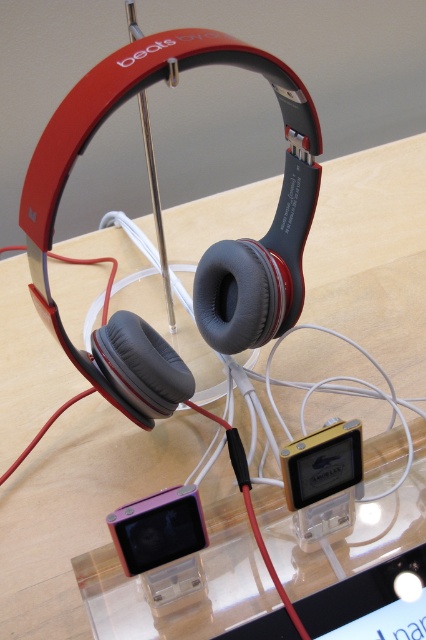
Does pink glossy ipod at lower center have a smaller size compared to metallic pink ipod at center?

Actually, pink glossy ipod at lower center might be larger than metallic pink ipod at center.

Is pink glossy ipod at lower center closer to camera compared to metallic pink ipod at center?

Yes, pink glossy ipod at lower center is closer to the viewer.

This screenshot has height=640, width=426. In order to click on pink glossy ipod at lower center in this screenshot , I will do `click(158, 529)`.

Locate an element on the screen. pink glossy ipod at lower center is located at coordinates (158, 529).